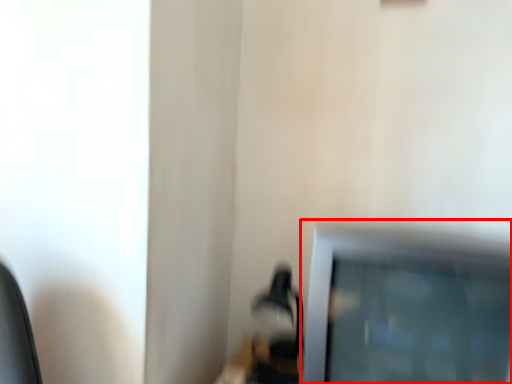
Question: From the image's perspective, what is the correct spatial positioning of television (annotated by the red box) in reference to table lamp?

Choices:
 (A) above
 (B) below

Answer: (A)